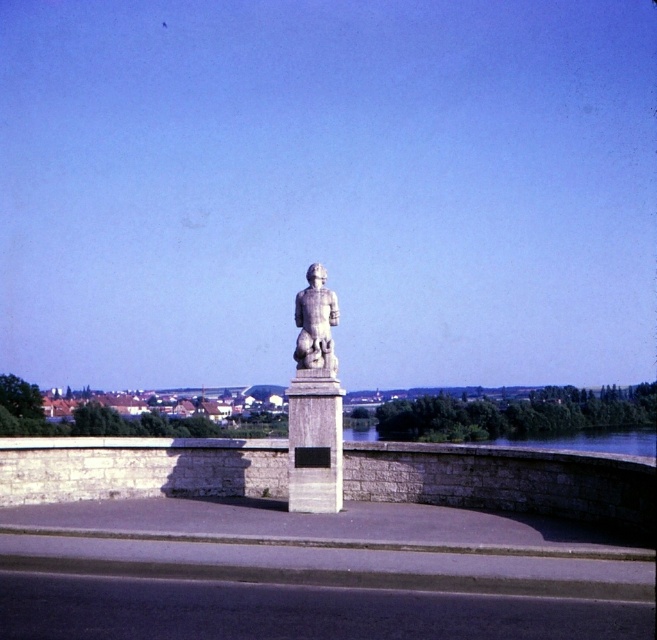
You are standing at the point marked by the coordinates point (x=313, y=403). Looking around, you see the white stone statue at center and the plaque on the pedestal. Which direction should you walk to reach the plaque on the pedestal?

The plaque on the pedestal is part of the white stone statue at center, so you are already at the pedestal. No need to move.